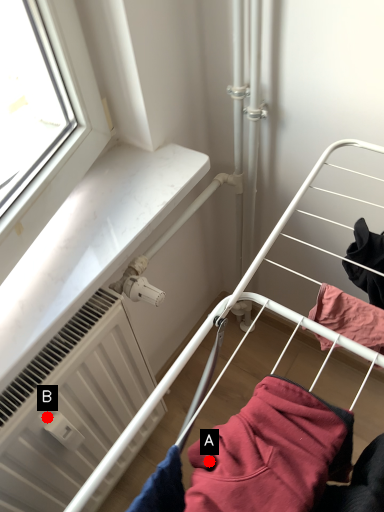
Question: Two points are circled on the image, labeled by A and B beside each circle. Which point is closer to the camera taking this photo?

Choices:
 (A) A is closer
 (B) B is closer

Answer: (A)